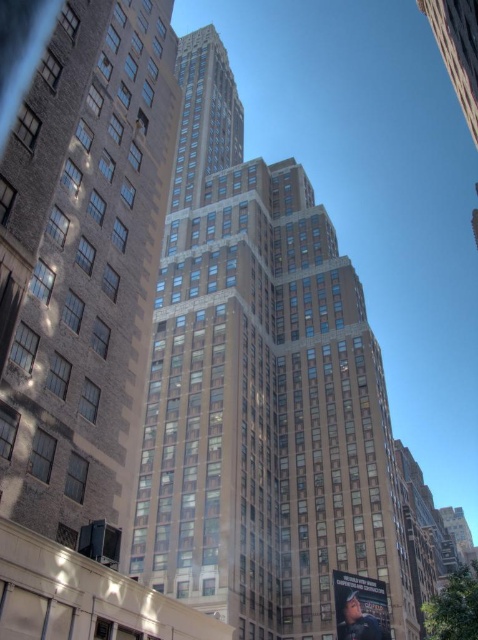
Question: Considering the relative positions of brown stone building at center and brown brick building at left in the image provided, where is brown stone building at center located with respect to brown brick building at left?

Choices:
 (A) below
 (B) above

Answer: (B)

Question: In this image, where is brown stone building at center located relative to brown brick building at left?

Choices:
 (A) below
 (B) above

Answer: (B)

Question: Which object is farther from the camera taking this photo?

Choices:
 (A) brown brick building at left
 (B) brown stone building at center

Answer: (B)

Question: Is brown stone building at center further to the viewer compared to brown brick building at left?

Choices:
 (A) yes
 (B) no

Answer: (A)

Question: Among these objects, which one is farthest from the camera?

Choices:
 (A) brown brick building at left
 (B) brown stone building at center

Answer: (B)